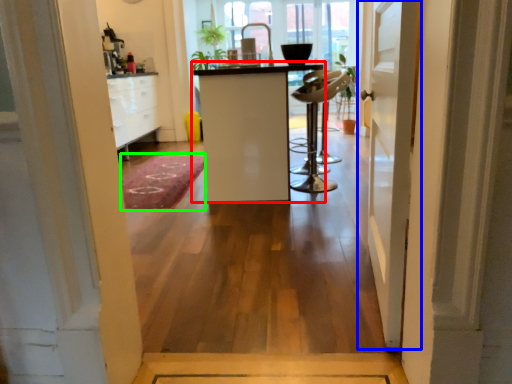
Question: Which object is the closest to the furniture (highlighted by a red box)? Choose among these: door (highlighted by a blue box) or doormat (highlighted by a green box).

Choices:
 (A) door
 (B) doormat

Answer: (B)